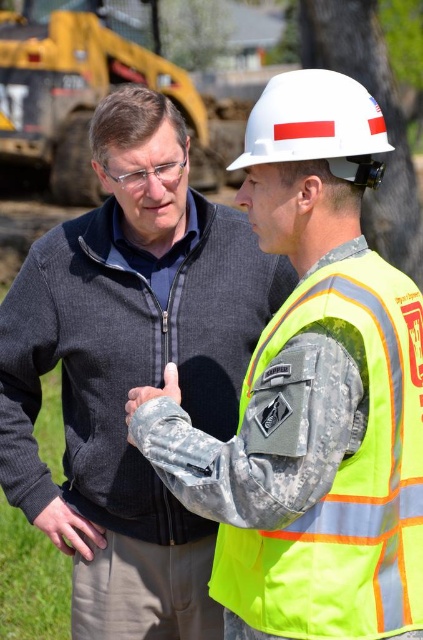
Who is more distant from viewer, [82,580] or [406,556]?

The point [82,580] is more distant.

Is camouflage uniform at center behind neon yellow reflective safety vest at right?

Yes, it is.

Find the location of a particular element. camouflage uniform at center is located at coordinates (131, 369).

Is neon yellow reflective safety vest at right bigger than white hard hat at center?

Indeed, neon yellow reflective safety vest at right has a larger size compared to white hard hat at center.

Is point (343, 298) farther from camera compared to point (365, 182)?

No, (343, 298) is in front of (365, 182).

Does point (290, 540) come farther from viewer compared to point (340, 138)?

No, it is not.

I want to click on neon yellow reflective safety vest at right, so click(x=343, y=472).

Can you confirm if white hard hat at center is smaller than camouflage fabric at center?

No, white hard hat at center is not smaller than camouflage fabric at center.

Which is more to the right, white hard hat at center or camouflage fabric at center?

From the viewer's perspective, white hard hat at center appears more on the right side.

Is point (296, 81) less distant than point (170, 372)?

Yes, point (296, 81) is in front of point (170, 372).

You are a GUI agent. You are given a task and a screenshot of the screen. Output one action in this format:
    pyautogui.click(x=<x>, y=<y>)
    Task: Click on the white hard hat at center
    This screenshot has height=640, width=423.
    Given the screenshot: What is the action you would take?
    pyautogui.click(x=316, y=125)